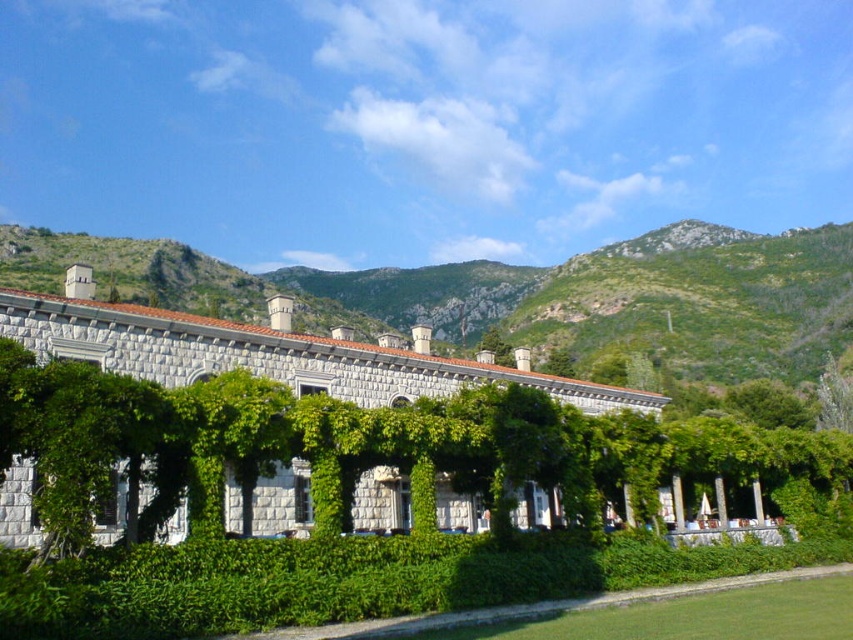
Question: Which is nearer to the green grassy hillside at upper center?

Choices:
 (A) green leafy tree at center
 (B) green ivy hedge at center

Answer: (A)

Question: Which point is closer to the camera taking this photo?

Choices:
 (A) (508, 392)
 (B) (788, 356)

Answer: (A)

Question: Which object appears farthest from the camera in this image?

Choices:
 (A) green grassy hillside at upper center
 (B) green ivy hedge at center
 (C) green leafy tree at center

Answer: (A)

Question: Can you confirm if green ivy hedge at center is positioned to the right of green grassy hillside at upper center?

Choices:
 (A) no
 (B) yes

Answer: (A)

Question: Does green ivy hedge at center appear on the right side of green grassy hillside at upper center?

Choices:
 (A) yes
 (B) no

Answer: (B)

Question: Where is green ivy hedge at center located in relation to green leafy tree at center in the image?

Choices:
 (A) below
 (B) above

Answer: (B)